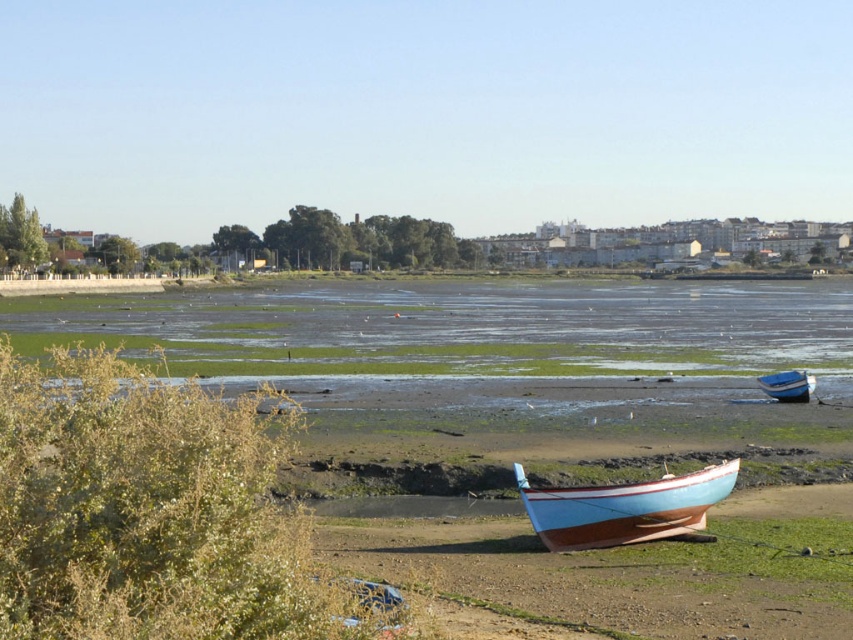
You are a photographer planning to capture the light blue wooden boat at lower center and the blue wooden boat at lower right in a single shot. Given that your camera has a limited field of view, which boat should you position closer to the center of the frame to ensure both are fully visible?

You should position the light blue wooden boat at lower center closer to the center of the frame because it is larger than the blue wooden boat at lower right, making it easier to include both within the camera frame.

You are standing at the origin point of the coordinate system in the image. You want to walk to the light blue wooden boat at lower center. What are the coordinates you need to move to?

The coordinates you need to move to are approximately 0.794 on the x axis and 0.733 on the y axis to reach the light blue wooden boat at lower center.